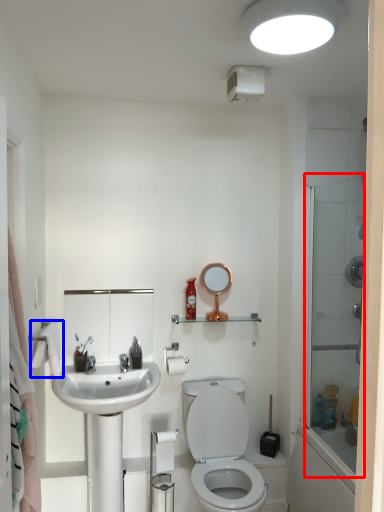
Question: Which of the following is the closest to the observer, glass door (highlighted by a red box) or bath towel (highlighted by a blue box)?

Choices:
 (A) glass door
 (B) bath towel

Answer: (A)